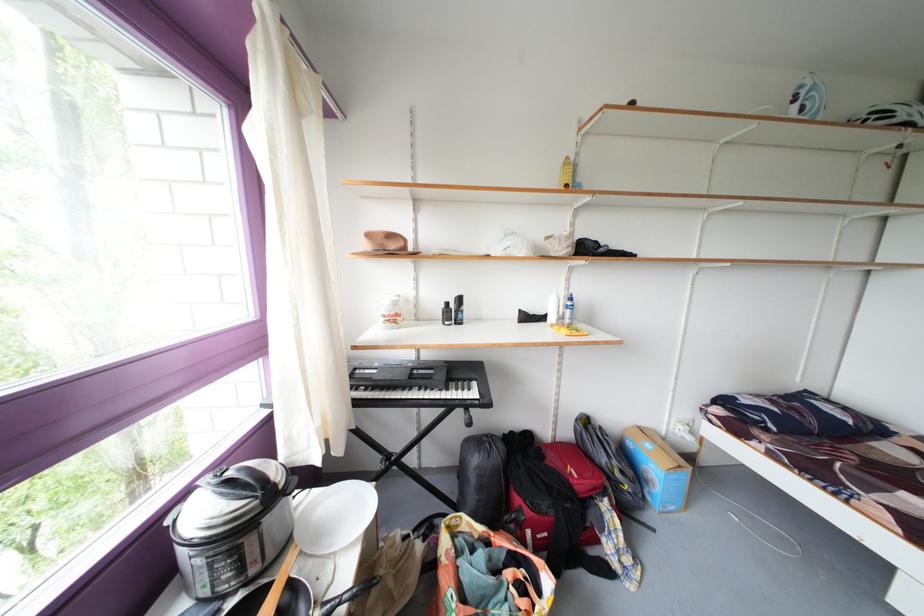
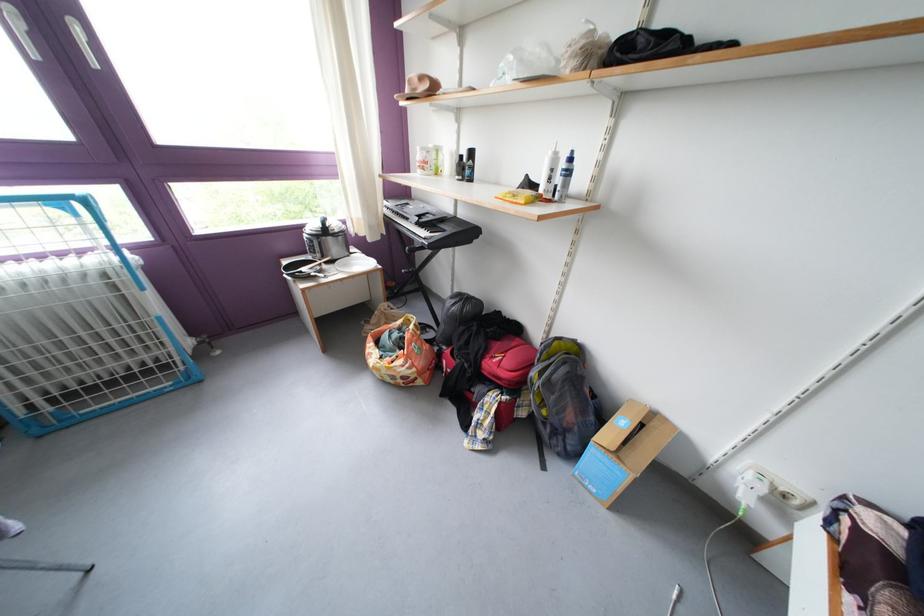
Find the pixel in the second image that matches pixel 457 310 in the first image.

(471, 161)